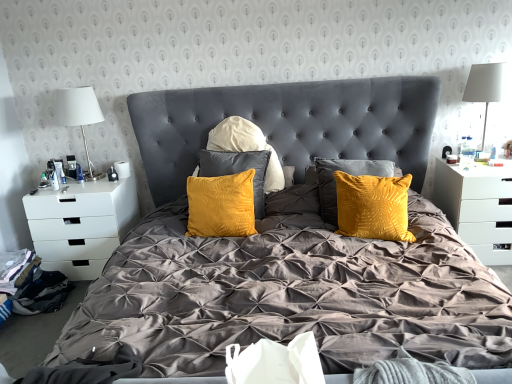
Question: Can you confirm if black fabric at lower left is bigger than velvet yellow pillows at center?

Choices:
 (A) no
 (B) yes

Answer: (A)

Question: Does black fabric at lower left come behind velvet yellow pillows at center?

Choices:
 (A) no
 (B) yes

Answer: (B)

Question: From the image's perspective, is black fabric at lower left beneath velvet yellow pillows at center?

Choices:
 (A) no
 (B) yes

Answer: (B)

Question: Can you confirm if black fabric at lower left is positioned to the left of velvet yellow pillows at center?

Choices:
 (A) no
 (B) yes

Answer: (B)

Question: Is black fabric at lower left to the right of velvet yellow pillows at center from the viewer's perspective?

Choices:
 (A) no
 (B) yes

Answer: (A)

Question: From the image's perspective, relative to black fabric at lower left, is white fabric lampshade at upper right, placed as the first table lamp when sorted from right to left, above or below?

Choices:
 (A) below
 (B) above

Answer: (B)

Question: Which is correct: white fabric lampshade at upper right, placed as the first table lamp when sorted from right to left, is inside black fabric at lower left, or outside of it?

Choices:
 (A) inside
 (B) outside

Answer: (B)

Question: From their relative heights in the image, would you say white fabric lampshade at upper right, placed as the first table lamp when sorted from right to left, is taller or shorter than black fabric at lower left?

Choices:
 (A) short
 (B) tall

Answer: (B)

Question: Based on their sizes in the image, would you say white fabric lampshade at upper right, which is the second table lamp from left to right, is bigger or smaller than black fabric at lower left?

Choices:
 (A) small
 (B) big

Answer: (B)

Question: Considering the positions of white matte drawer at left, which is the first nightstand in left-to-right order, and white fabric lampshade at upper right, placed as the first table lamp when sorted from right to left, in the image, is white matte drawer at left, which is the first nightstand in left-to-right order, wider or thinner than white fabric lampshade at upper right, placed as the first table lamp when sorted from right to left,?

Choices:
 (A) thin
 (B) wide

Answer: (B)

Question: Which is correct: white matte drawer at left, which is the first nightstand in left-to-right order, is inside white fabric lampshade at upper right, placed as the first table lamp when sorted from right to left, or outside of it?

Choices:
 (A) outside
 (B) inside

Answer: (A)

Question: Does point (96, 210) appear closer or farther from the camera than point (468, 97)?

Choices:
 (A) farther
 (B) closer

Answer: (B)

Question: From their relative heights in the image, would you say white matte drawer at left, which is counted as the second nightstand, starting from the right, is taller or shorter than white fabric lampshade at upper right, which is the second table lamp from left to right?

Choices:
 (A) tall
 (B) short

Answer: (B)

Question: Considering the positions of point (79, 102) and point (488, 76), is point (79, 102) closer or farther from the camera than point (488, 76)?

Choices:
 (A) closer
 (B) farther

Answer: (B)

Question: Is white fabric lampshade at left, which is counted as the first table lamp, starting from the left, inside or outside of white fabric lampshade at upper right, placed as the first table lamp when sorted from right to left?

Choices:
 (A) inside
 (B) outside

Answer: (B)